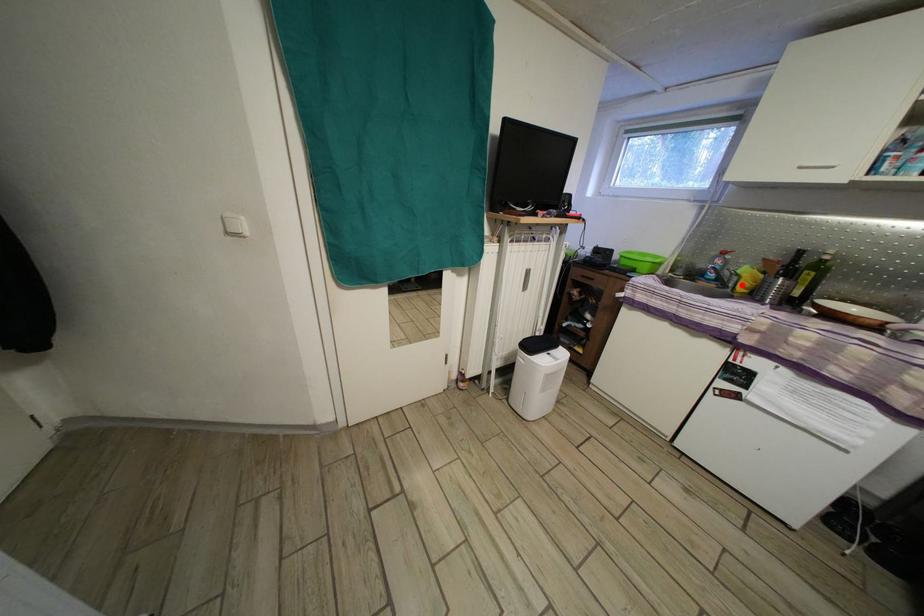
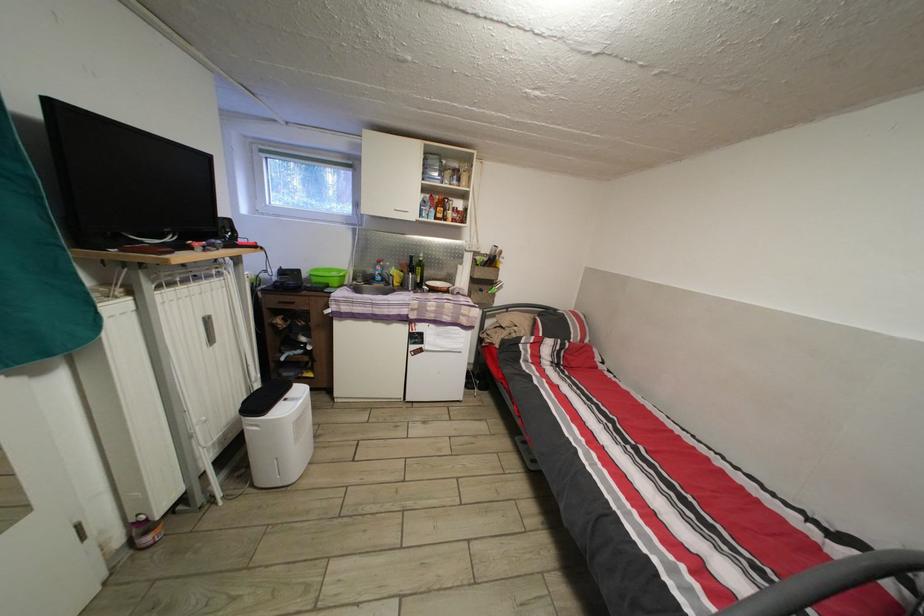
The point at the highlighted location is marked in the first image. Where is the corresponding point in the second image?

(398, 285)